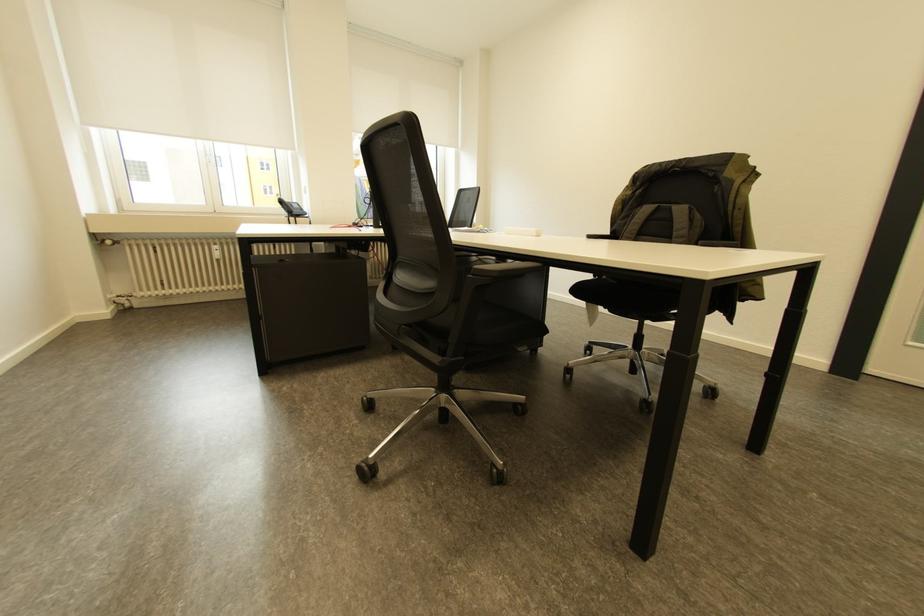
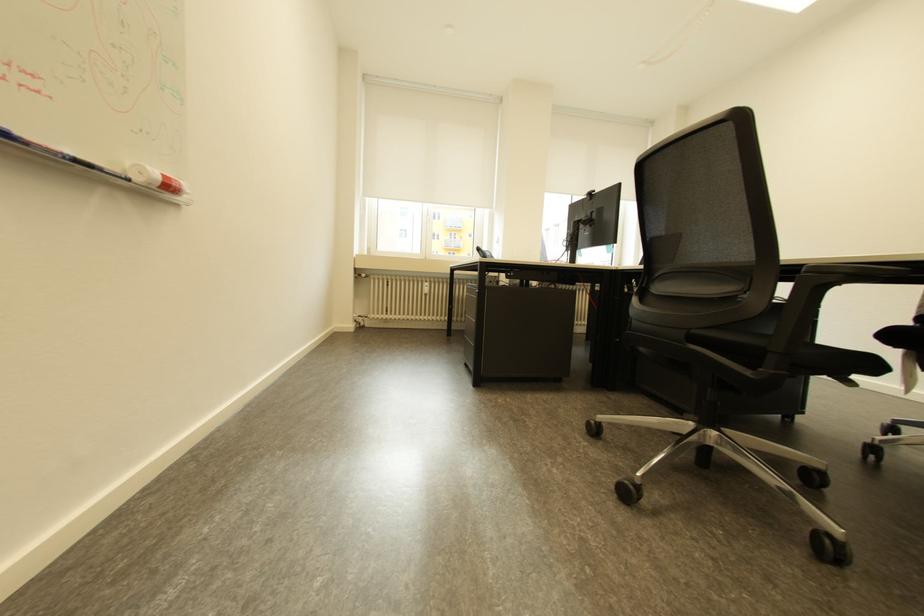
Question: The first image is from the beginning of the video and the second image is from the end. How did the camera likely rotate when shooting the video?

Choices:
 (A) Left
 (B) Right
 (C) Up
 (D) Down

Answer: (A)